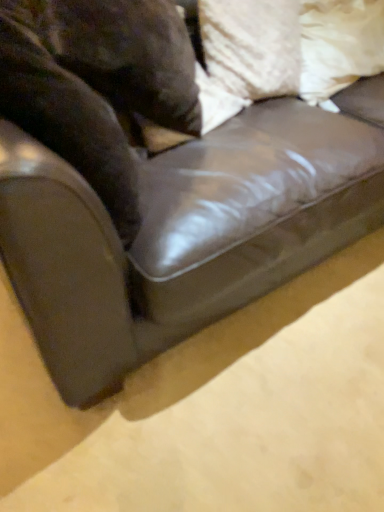
Question: Would you say white textured pillow at upper right, acting as the second pillow starting from the right, is inside or outside brown fur at left?

Choices:
 (A) outside
 (B) inside

Answer: (A)

Question: In the image, is white textured pillow at upper right, the 1th pillow when ordered from left to right, positioned in front of or behind brown fur at left?

Choices:
 (A) behind
 (B) front

Answer: (A)

Question: Which object is the farthest from the brown fur at left?

Choices:
 (A) white fabric pillow at upper right, which is the first pillow in right-to-left order
 (B) white textured pillow at upper right, the 1th pillow when ordered from left to right

Answer: (A)

Question: Which object is the farthest from the white textured pillow at upper right, acting as the second pillow starting from the right?

Choices:
 (A) white fabric pillow at upper right, which is the first pillow in right-to-left order
 (B) brown fur at left

Answer: (B)